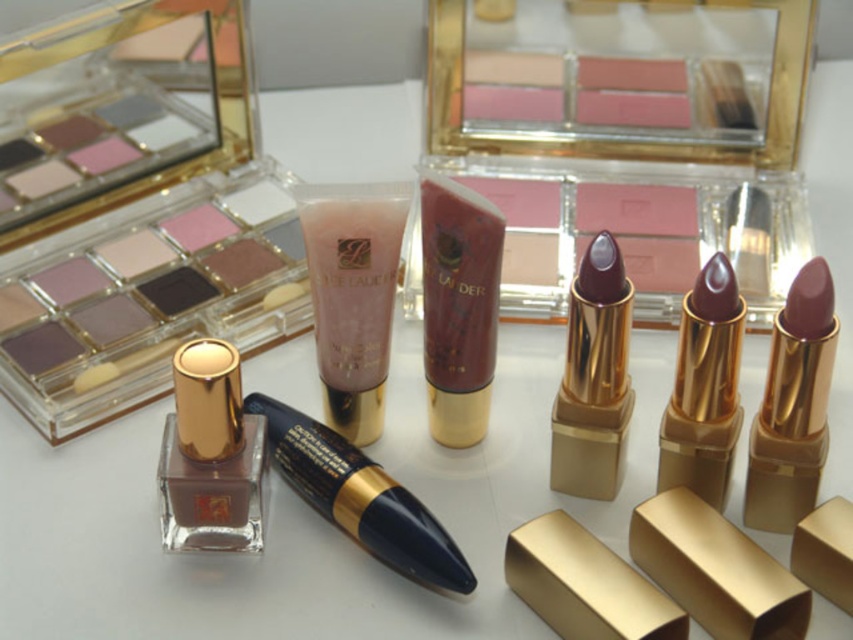
Question: Is matte pink tube at center thinner than matte purple lipstick at center-right?

Choices:
 (A) no
 (B) yes

Answer: (B)

Question: Is matte pink cream at center below satin gold lipstick at center?

Choices:
 (A) yes
 (B) no

Answer: (B)

Question: Which point is closer to the camera taking this photo?

Choices:
 (A) (363, 323)
 (B) (579, 413)
 (C) (463, 582)

Answer: (C)

Question: Where is satin gold lipstick at center located in relation to matte purple lipstick at center-right in the image?

Choices:
 (A) right
 (B) left

Answer: (B)

Question: Which point is farther to the camera?

Choices:
 (A) (831, 301)
 (B) (624, 276)

Answer: (B)

Question: Based on their relative distances, which object is farther from the matte pink cream at center?

Choices:
 (A) matte gold lipstick at right
 (B) matte purple lipstick at center-right
 (C) shiny purple lipstick at center
 (D) satin gold lipstick at center

Answer: (A)